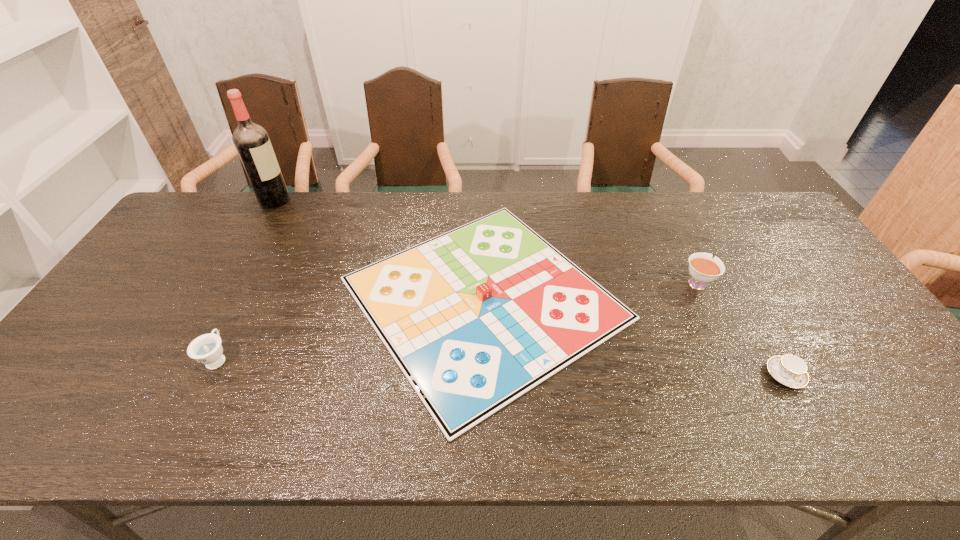
Find the location of a particular element. This screenshot has width=960, height=540. vacant space in between the third object from left to right and the farthest object is located at coordinates (379, 249).

This screenshot has width=960, height=540. I want to click on the closest object to the leftmost teacup, so click(475, 317).

Image resolution: width=960 pixels, height=540 pixels. Find the location of `object that is the second closest to the farthest teacup`. object that is the second closest to the farthest teacup is located at coordinates (789, 370).

Where is `the second closest teacup to the shortest teacup`? This screenshot has width=960, height=540. the second closest teacup to the shortest teacup is located at coordinates (206, 349).

The height and width of the screenshot is (540, 960). What are the coordinates of `teacup that is the closest to the rightmost teacup` in the screenshot? It's located at (703, 269).

The width and height of the screenshot is (960, 540). I want to click on free space that satisfies the following two spatial constraints: 1. on the front-facing side of the tallest object; 2. on the left side of the gameboard, so click(220, 298).

You are a GUI agent. You are given a task and a screenshot of the screen. Output one action in this format:
    pyautogui.click(x=<x>, y=<y>)
    Task: Click on the vacant space that satisfies the following two spatial constraints: 1. on the side of the third shortest object with the handle; 2. on the front-facing side of the tallest object
    
    Given the screenshot: What is the action you would take?
    pyautogui.click(x=297, y=200)

Find the location of a particular element. The width and height of the screenshot is (960, 540). free space that satisfies the following two spatial constraints: 1. on the front-facing side of the liquor; 2. on the back side of the gameboard is located at coordinates (220, 298).

I want to click on vacant space that satisfies the following two spatial constraints: 1. on the front-facing side of the liquor; 2. on the side of the second tallest object with the handle, so click(228, 282).

Where is `vacant space that satisfies the following two spatial constraints: 1. on the side of the third tallest object with the handle; 2. on the left side of the gameboard`? The height and width of the screenshot is (540, 960). vacant space that satisfies the following two spatial constraints: 1. on the side of the third tallest object with the handle; 2. on the left side of the gameboard is located at coordinates (248, 298).